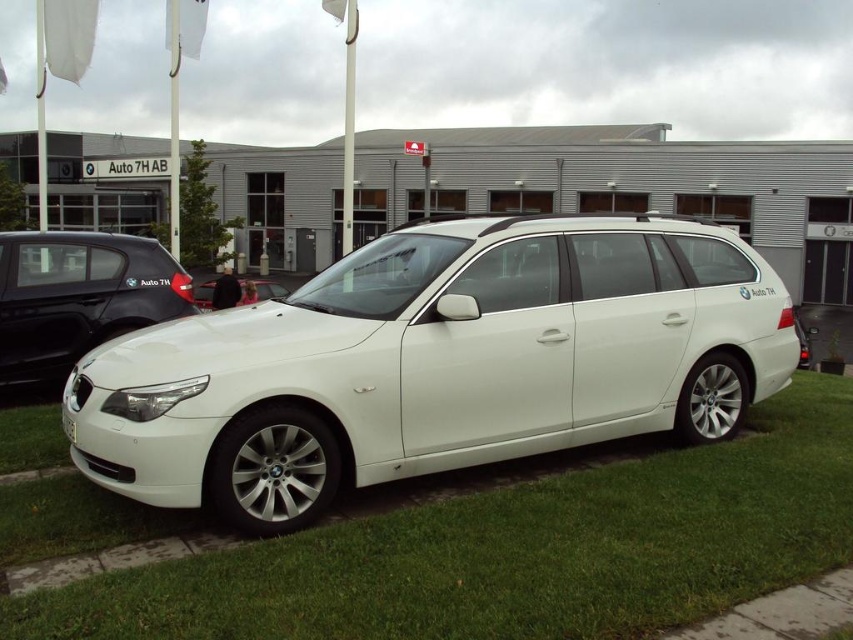
Is point (465, 243) less distant than point (834, 465)?

Yes, it is.

Is white metallic car at center wider than green grass at lower center?

Yes.

Does point (305, 520) come closer to viewer compared to point (102, 516)?

That is False.

Locate an element on the screen. white metallic car at center is located at coordinates (434, 364).

Does white metallic car at center appear under white matte car at center?

Yes.

Who is more forward, (370, 248) or (201, 296)?

Point (370, 248) is more forward.

Between point (325, 508) and point (276, 288), which one is positioned in front?

Point (325, 508) is more forward.

Where is `white metallic car at center`? white metallic car at center is located at coordinates (434, 364).

Measure the distance from white metallic car at center to white metallic car at left.

white metallic car at center and white metallic car at left are 4.11 meters apart from each other.

Does white metallic car at center appear on the left side of white metallic car at left?

Incorrect, white metallic car at center is not on the left side of white metallic car at left.

Find the location of a particular element. white metallic car at center is located at coordinates (434, 364).